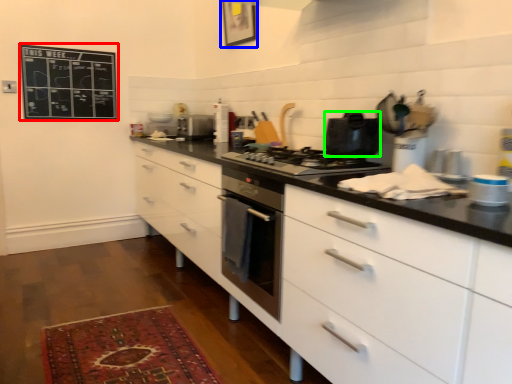
Question: Which object is the farthest from bulletin board (highlighted by a red box)? Choose among these: picture frame (highlighted by a blue box) or kitchen appliance (highlighted by a green box).

Choices:
 (A) picture frame
 (B) kitchen appliance

Answer: (B)